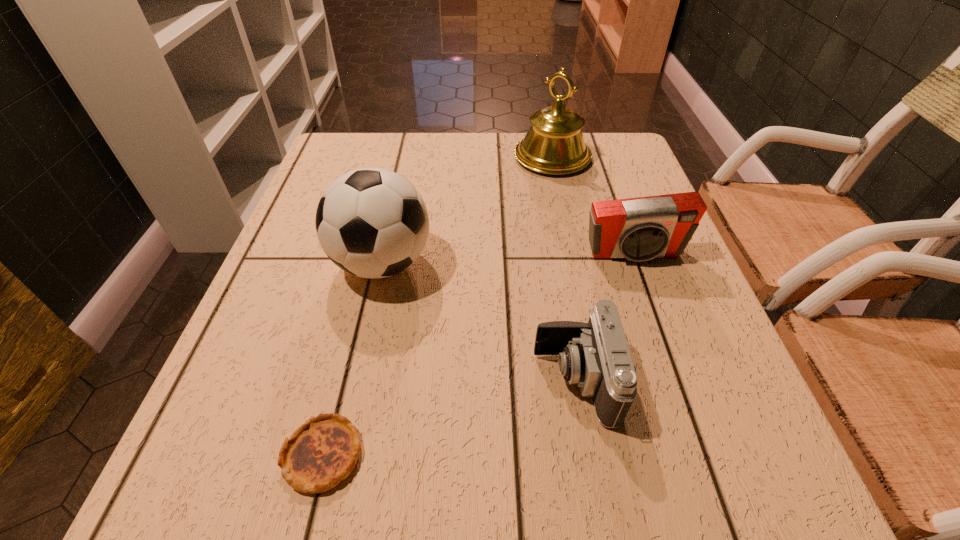
The height and width of the screenshot is (540, 960). I want to click on free spot located 0.340m at the front of the left camera with an open lens cover, so click(x=321, y=380).

Identify the location of vacant space located 0.210m at the front of the left camera with an open lens cover. (402, 380).

Locate an element on the screen. This screenshot has height=540, width=960. vacant space located 0.360m at the front of the left camera with an open lens cover is located at coordinates (307, 380).

Where is `vacant space located on the back of the shortest object`? The width and height of the screenshot is (960, 540). vacant space located on the back of the shortest object is located at coordinates (373, 249).

You are a GUI agent. You are given a task and a screenshot of the screen. Output one action in this format:
    pyautogui.click(x=<x>, y=<y>)
    Task: Click on the object present at the far edge
    This screenshot has width=960, height=540.
    Given the screenshot: What is the action you would take?
    pyautogui.click(x=554, y=144)

Identify the location of object at the near edge. (323, 451).

The height and width of the screenshot is (540, 960). Find the location of `soccer ball that is at the left edge`. soccer ball that is at the left edge is located at coordinates (372, 223).

This screenshot has width=960, height=540. I want to click on quiche at the left edge, so click(x=323, y=451).

This screenshot has width=960, height=540. Find the location of `bell located in the right edge section of the desktop`. bell located in the right edge section of the desktop is located at coordinates (554, 144).

This screenshot has width=960, height=540. Find the location of `camera present at the right edge`. camera present at the right edge is located at coordinates (639, 229).